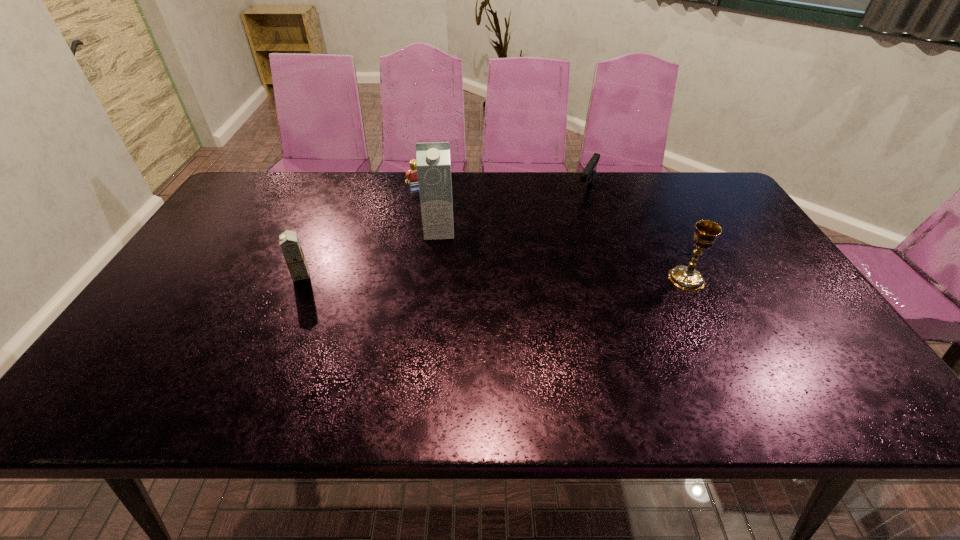
What are the coordinates of `the third shortest object` in the screenshot? It's located at (289, 242).

The width and height of the screenshot is (960, 540). What are the coordinates of `the leftmost object` in the screenshot? It's located at (289, 242).

Locate an element on the screen. The image size is (960, 540). the second tallest object is located at coordinates pyautogui.click(x=687, y=278).

This screenshot has width=960, height=540. Identify the location of chalice. (687, 278).

At what (x,y) coordinates should I click in order to perform the action: click on the fourth object from left to right. Please return your answer as a coordinate pair (x, y). The width and height of the screenshot is (960, 540). Looking at the image, I should click on (588, 174).

The height and width of the screenshot is (540, 960). Find the location of `Lego`. Lego is located at coordinates (412, 172).

Image resolution: width=960 pixels, height=540 pixels. In order to click on the third nearest object in this screenshot , I will do `click(433, 163)`.

Find the location of a particular element. the tallest object is located at coordinates pyautogui.click(x=433, y=163).

Where is `blank space located on the left of the leftmost object`? This screenshot has height=540, width=960. blank space located on the left of the leftmost object is located at coordinates (175, 275).

This screenshot has width=960, height=540. In order to click on vacant space situated on the left of the fourth shortest object in this screenshot , I will do `click(592, 279)`.